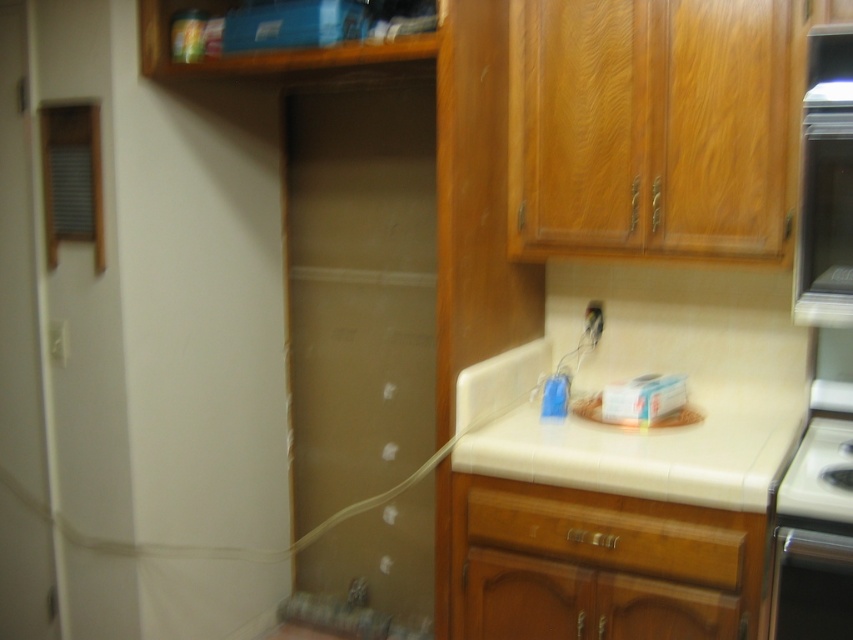
You are a contractor working in the kitchen and need to place a heavy tool on the surface. Which object, the beige tile countertop at center or the black glossy stove at lower right, would be more suitable for placing the tool?

The beige tile countertop at center is positioned on the left side of the black glossy stove at lower right, so it is a more stable and appropriate surface for placing heavy tools compared to the stove.

You are a contractor working in the kitchen and need to determine the order of tasks based on their positions. Which point, point (460, 440) or point (833, 586), is closer to you?

Point (460, 440) is closer to you than point (833, 586) because it is further to the camera.